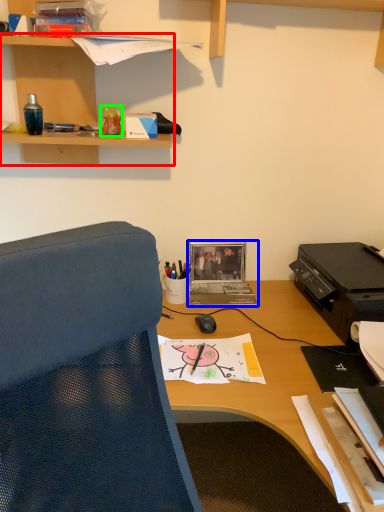
Question: Estimate the real-world distances between objects in this image. Which object is closer to shelf (highlighted by a red box), laptop (highlighted by a blue box) or stationery (highlighted by a green box)?

Choices:
 (A) laptop
 (B) stationery

Answer: (B)